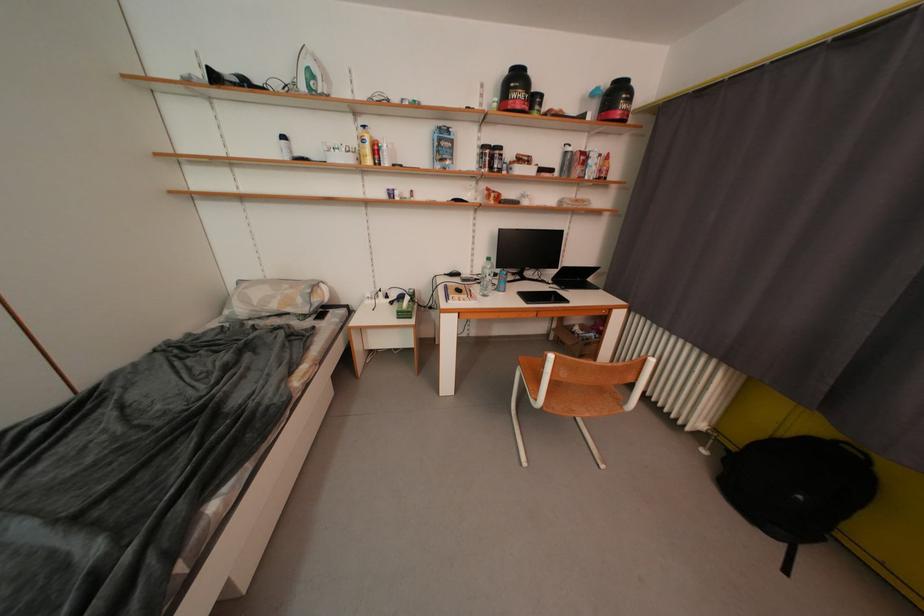
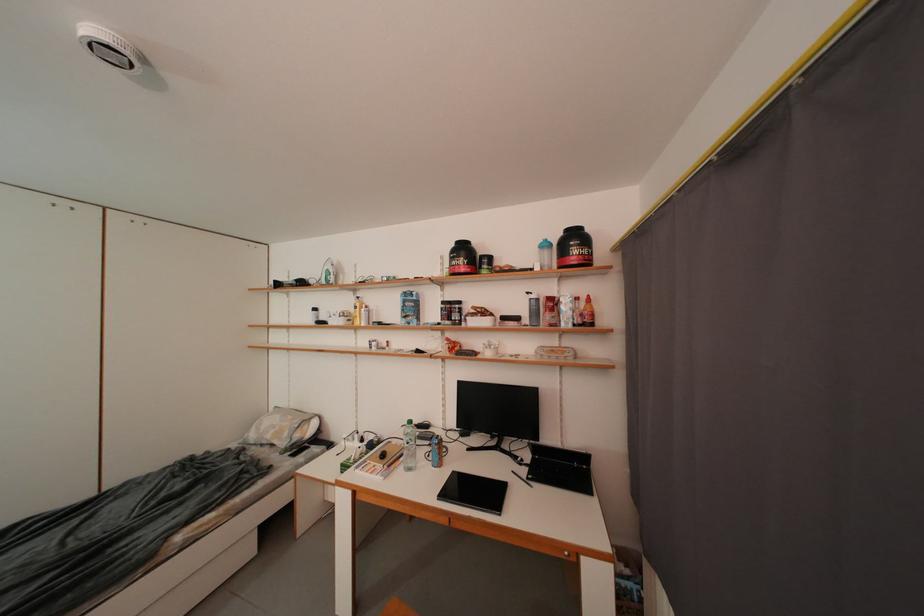
Where in the second image is the point corresponding to point (564, 177) from the first image?

(533, 323)